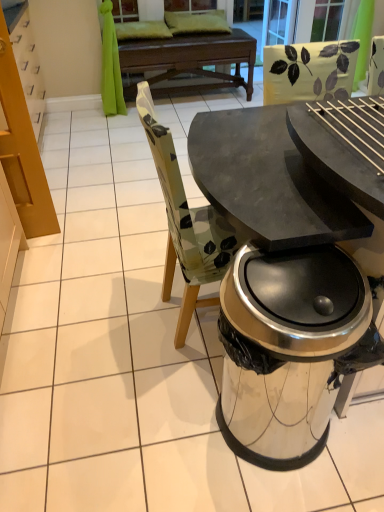
Image resolution: width=384 pixels, height=512 pixels. Describe the element at coordinates (268, 181) in the screenshot. I see `matte black table at center` at that location.

Measure the distance between point [309,8] and camera.

Point [309,8] is 4.10 meters from camera.

Identify the location of clear glass screen door at upper center, which is the 2th screen door in left-to-right order. The image size is (384, 512). (320, 20).

This screenshot has width=384, height=512. What are the coordinates of `transparent glass screen door at upper center, which is the 1th screen door in left-to-right order` in the screenshot? It's located at (278, 22).

Which object is wider, clear glass screen door at upper center, which is the 2th screen door in left-to-right order, or matte black table at center?

matte black table at center is wider.

Is clear glass screen door at upper center, which is the 2th screen door in left-to-right order, inside or outside of matte black table at center?

clear glass screen door at upper center, which is the 2th screen door in left-to-right order, is spatially situated outside matte black table at center.

Does clear glass screen door at upper center, which is the 1th screen door from right to left, have a greater height compared to matte black table at center?

No.

Is clear glass screen door at upper center, which is the 2th screen door in left-to-right order, not close to matte black table at center?

Indeed, clear glass screen door at upper center, which is the 2th screen door in left-to-right order, is not near matte black table at center.

Would you say shiny metallic trash can at lower right is a long distance from transparent glass screen door at upper center, the 2th screen door positioned from the right?

Yes, shiny metallic trash can at lower right and transparent glass screen door at upper center, the 2th screen door positioned from the right, are located far from each other.

From a real-world perspective, is shiny metallic trash can at lower right positioned under transparent glass screen door at upper center, the 2th screen door positioned from the right, based on gravity?

Yes.

Is point (221, 312) more distant than point (294, 22)?

That is False.

Considering the relative sizes of shiny metallic trash can at lower right and transparent glass screen door at upper center, which is the 1th screen door in left-to-right order, in the image provided, is shiny metallic trash can at lower right shorter than transparent glass screen door at upper center, which is the 1th screen door in left-to-right order,?

No.

Between matte black table at center and clear glass screen door at upper center, which is the 1th screen door from right to left, which one appears on the right side from the viewer's perspective?

From the viewer's perspective, clear glass screen door at upper center, which is the 1th screen door from right to left, appears more on the right side.

Considering the sizes of objects matte black table at center and clear glass screen door at upper center, which is the 2th screen door in left-to-right order, in the image provided, who is smaller, matte black table at center or clear glass screen door at upper center, which is the 2th screen door in left-to-right order,?

Smaller between the two is clear glass screen door at upper center, which is the 2th screen door in left-to-right order.

From a real-world perspective, which object stands above the other?

clear glass screen door at upper center, which is the 1th screen door from right to left.

Considering the points (337, 6) and (269, 32), which point is behind, point (337, 6) or point (269, 32)?

The point (269, 32) is behind.

Is clear glass screen door at upper center, which is the 1th screen door from right to left, taller than transparent glass screen door at upper center, which is the 1th screen door in left-to-right order?

No.

Measure the distance between clear glass screen door at upper center, which is the 2th screen door in left-to-right order, and transparent glass screen door at upper center, which is the 1th screen door in left-to-right order.

clear glass screen door at upper center, which is the 2th screen door in left-to-right order, and transparent glass screen door at upper center, which is the 1th screen door in left-to-right order, are 12.14 inches apart from each other.

Is transparent glass screen door at upper center, which is the 1th screen door in left-to-right order, facing away from dark wood round table at center?

No.

Can you confirm if transparent glass screen door at upper center, which is the 1th screen door in left-to-right order, is positioned to the right of dark wood round table at center?

Correct, you'll find transparent glass screen door at upper center, which is the 1th screen door in left-to-right order, to the right of dark wood round table at center.

From a real-world perspective, between matte black table at center and transparent glass screen door at upper center, which is the 1th screen door in left-to-right order, who is vertically higher?

matte black table at center, from a real-world perspective.

Who is bigger, matte black table at center or transparent glass screen door at upper center, which is the 1th screen door in left-to-right order?

Bigger between the two is matte black table at center.

Would you say matte black table at center is outside transparent glass screen door at upper center, which is the 1th screen door in left-to-right order?

That's correct, matte black table at center is outside of transparent glass screen door at upper center, which is the 1th screen door in left-to-right order.

From a real-world perspective, is transparent glass screen door at upper center, which is the 1th screen door in left-to-right order, physically located above or below shiny metallic trash can at lower right?

From a real-world perspective, transparent glass screen door at upper center, which is the 1th screen door in left-to-right order, is physically above shiny metallic trash can at lower right.

Who is taller, transparent glass screen door at upper center, the 2th screen door positioned from the right, or shiny metallic trash can at lower right?

With more height is shiny metallic trash can at lower right.

Is transparent glass screen door at upper center, which is the 1th screen door in left-to-right order, thinner than shiny metallic trash can at lower right?

Yes, transparent glass screen door at upper center, which is the 1th screen door in left-to-right order, is thinner than shiny metallic trash can at lower right.

Which screen door is the 2nd one when counting from the right side of the matte black table at center? Please provide its 2D coordinates.

[(320, 20)]

Image resolution: width=384 pixels, height=512 pixels. Find the location of `trash bin/can that appears on the left of transparent glass screen door at upper center, the 2th screen door positioned from the right`. trash bin/can that appears on the left of transparent glass screen door at upper center, the 2th screen door positioned from the right is located at coordinates (290, 349).

Looking at the image, which one is located closer to dark wood round table at center, clear glass screen door at upper center, which is the 2th screen door in left-to-right order, or matte black table at center?

Based on the image, clear glass screen door at upper center, which is the 2th screen door in left-to-right order, appears to be nearer to dark wood round table at center.

Based on their spatial positions, is transparent glass screen door at upper center, the 2th screen door positioned from the right, or clear glass screen door at upper center, which is the 1th screen door from right to left, further from dark wood round table at center?

transparent glass screen door at upper center, the 2th screen door positioned from the right, is further to dark wood round table at center.

Consider the image. From the image, which object appears to be farther from transparent glass screen door at upper center, which is the 1th screen door in left-to-right order, matte black table at center or clear glass screen door at upper center, which is the 2th screen door in left-to-right order?

Among the two, matte black table at center is located further to transparent glass screen door at upper center, which is the 1th screen door in left-to-right order.

From the image, which object appears to be nearer to transparent glass screen door at upper center, which is the 1th screen door in left-to-right order, matte black table at center or dark wood round table at center?

dark wood round table at center lies closer to transparent glass screen door at upper center, which is the 1th screen door in left-to-right order, than the other object.

Estimate the real-world distances between objects in this image. Which object is further from shiny metallic trash can at lower right, transparent glass screen door at upper center, which is the 1th screen door in left-to-right order, or clear glass screen door at upper center, which is the 1th screen door from right to left?

Among the two, transparent glass screen door at upper center, which is the 1th screen door in left-to-right order, is located further to shiny metallic trash can at lower right.

Based on their spatial positions, is clear glass screen door at upper center, which is the 2th screen door in left-to-right order, or dark wood round table at center further from transparent glass screen door at upper center, which is the 1th screen door in left-to-right order?

dark wood round table at center is further to transparent glass screen door at upper center, which is the 1th screen door in left-to-right order.

Based on their spatial positions, is transparent glass screen door at upper center, which is the 1th screen door in left-to-right order, or dark wood round table at center further from clear glass screen door at upper center, which is the 2th screen door in left-to-right order?

dark wood round table at center is positioned further to the anchor clear glass screen door at upper center, which is the 2th screen door in left-to-right order.

Which object lies further to the anchor point clear glass screen door at upper center, which is the 1th screen door from right to left, dark wood round table at center or shiny metallic trash can at lower right?

Based on the image, shiny metallic trash can at lower right appears to be further to clear glass screen door at upper center, which is the 1th screen door from right to left.

You are a GUI agent. You are given a task and a screenshot of the screen. Output one action in this format:
    pyautogui.click(x=<x>, y=<y>)
    Task: Click on the screen door located between dark wood round table at center and clear glass screen door at upper center, which is the 1th screen door from right to left, in the left-right direction
    
    Given the screenshot: What is the action you would take?
    pyautogui.click(x=278, y=22)

The height and width of the screenshot is (512, 384). I want to click on round table between shiny metallic trash can at lower right and transparent glass screen door at upper center, which is the 1th screen door in left-to-right order, along the z-axis, so click(x=187, y=63).

You are a GUI agent. You are given a task and a screenshot of the screen. Output one action in this format:
    pyautogui.click(x=<x>, y=<y>)
    Task: Click on the screen door between shiny metallic trash can at lower right and transparent glass screen door at upper center, which is the 1th screen door in left-to-right order, from front to back
    
    Given the screenshot: What is the action you would take?
    pyautogui.click(x=320, y=20)

Find the location of a particular element. Image resolution: width=384 pixels, height=512 pixels. table between shiny metallic trash can at lower right and clear glass screen door at upper center, which is the 2th screen door in left-to-right order, from front to back is located at coordinates (268, 181).